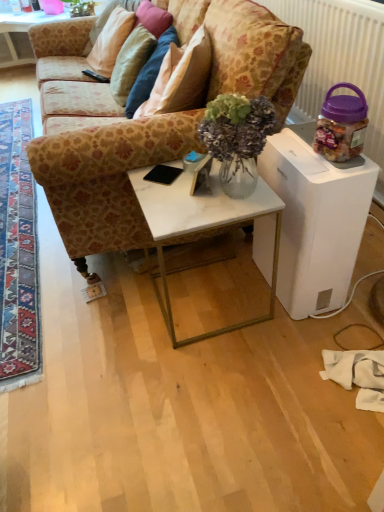
You are a GUI agent. You are given a task and a screenshot of the screen. Output one action in this format:
    pyautogui.click(x=<x>, y=<y>)
    Task: Click on the empty space that is to the right of black matte mobile phone at center
    
    Given the screenshot: What is the action you would take?
    pyautogui.click(x=209, y=186)